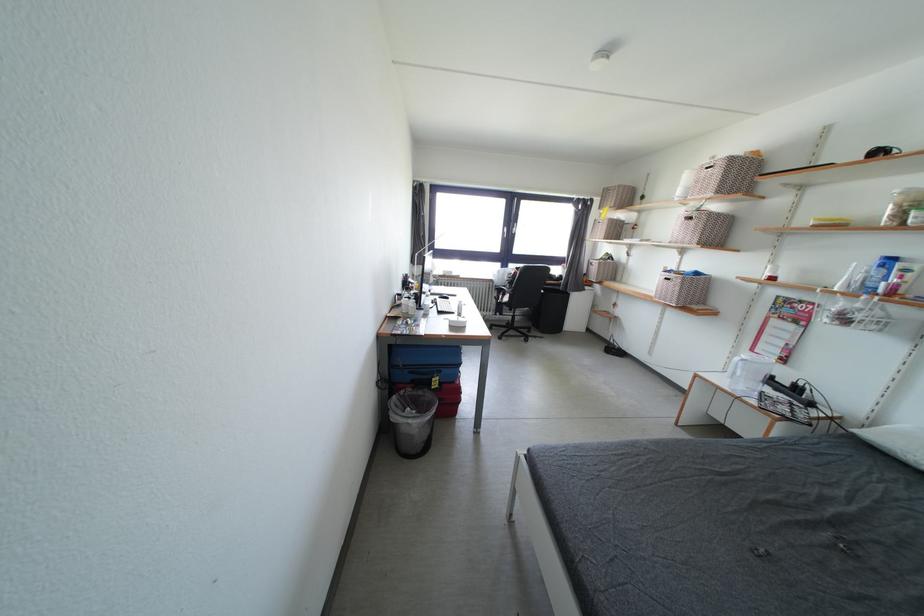
The image size is (924, 616). In order to click on chair sitting surface in this screenshot , I will do `click(514, 278)`.